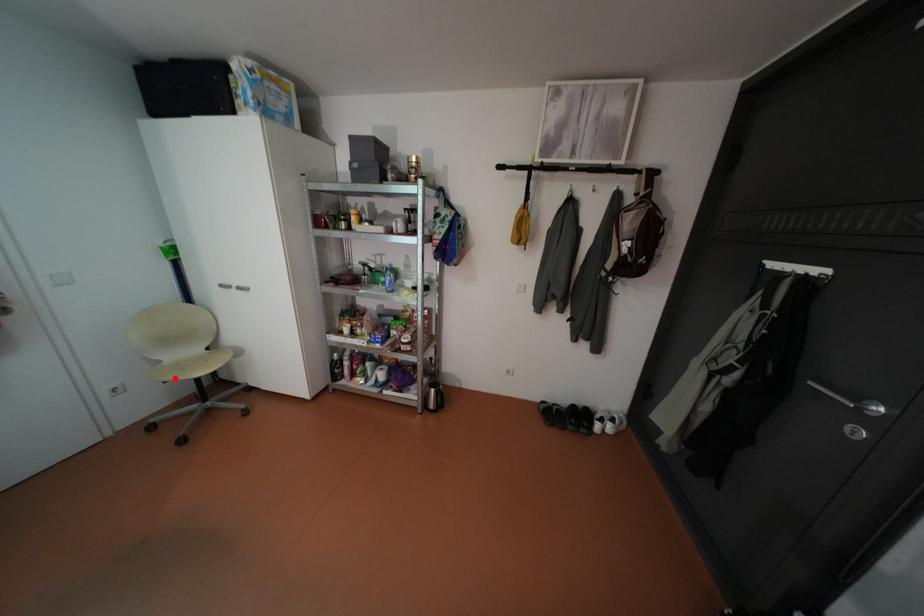
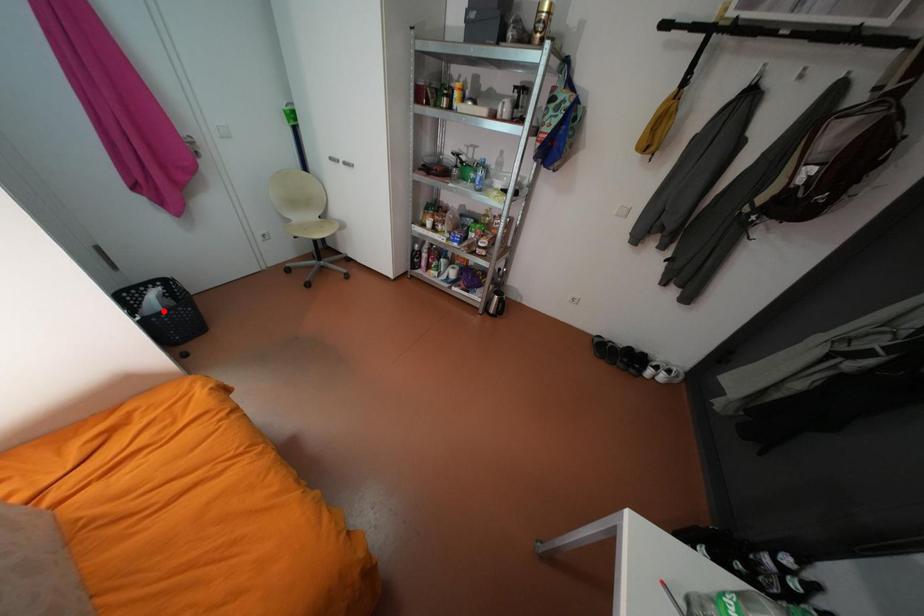
I am providing you with two images of the same scene from different viewpoints. A red point is marked on the first image and another point is marked on the second image. Do the highlighted points in image1 and image2 indicate the same real-world spot?

No